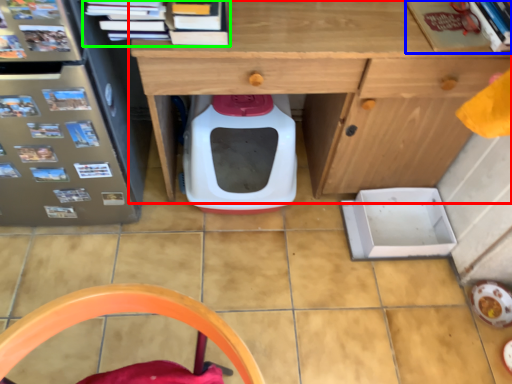
Question: Estimate the real-world distances between objects in this image. Which object is farther from desk (highlighted by a red box), book (highlighted by a blue box) or book (highlighted by a green box)?

Choices:
 (A) book
 (B) book

Answer: (B)